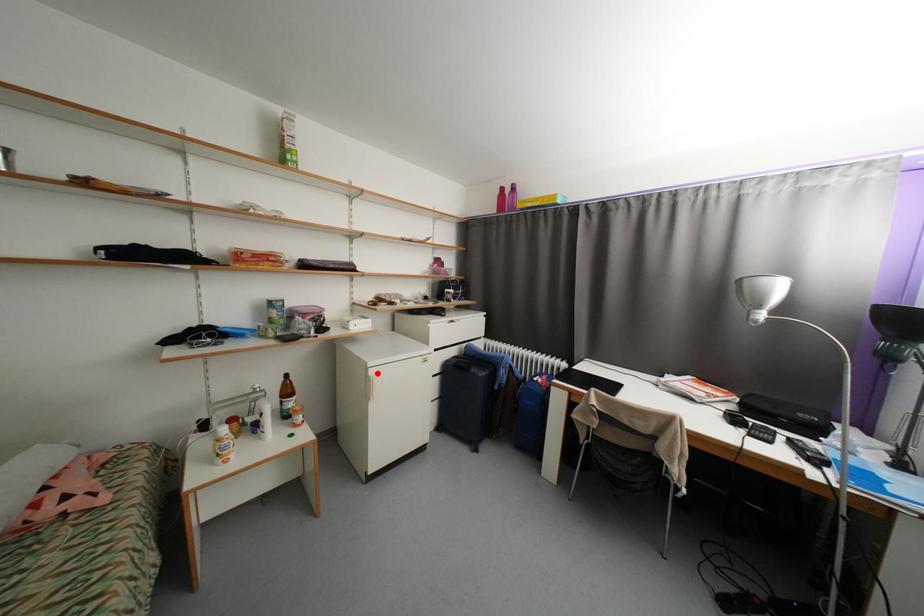
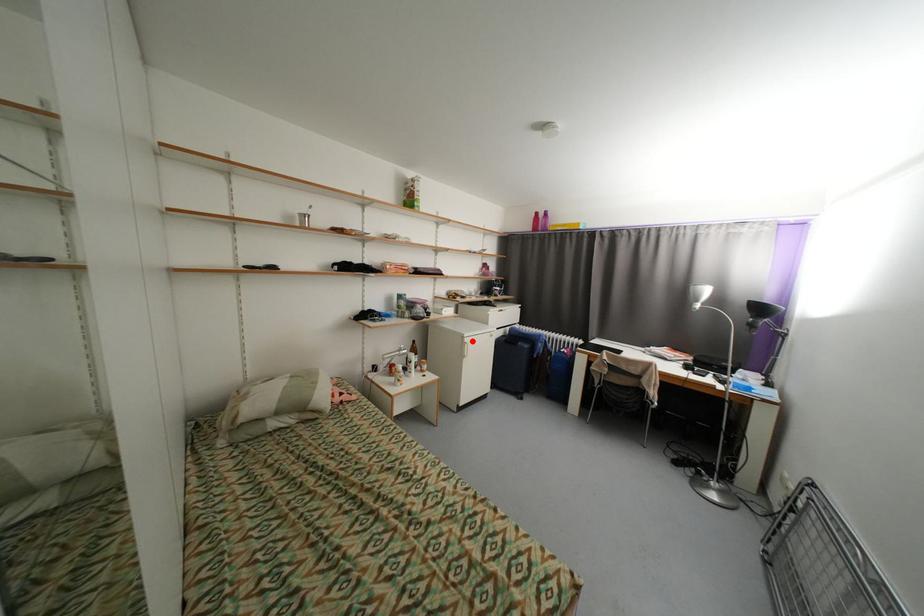
I am providing you with two images of the same scene from different viewpoints. A red point is marked on the first image and another point is marked on the second image. Does the point marked in image1 correspond to the same location as the one in image2?

Yes